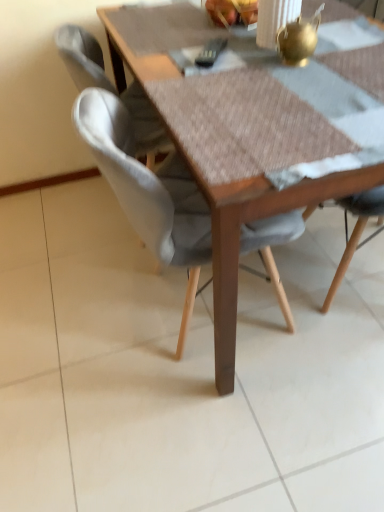
Identify the location of wooden table at center. The width and height of the screenshot is (384, 512). (228, 145).

The height and width of the screenshot is (512, 384). What do you see at coordinates (228, 145) in the screenshot? I see `wooden table at center` at bounding box center [228, 145].

Locate an element on the screen. Image resolution: width=384 pixels, height=512 pixels. wooden table at center is located at coordinates (228, 145).